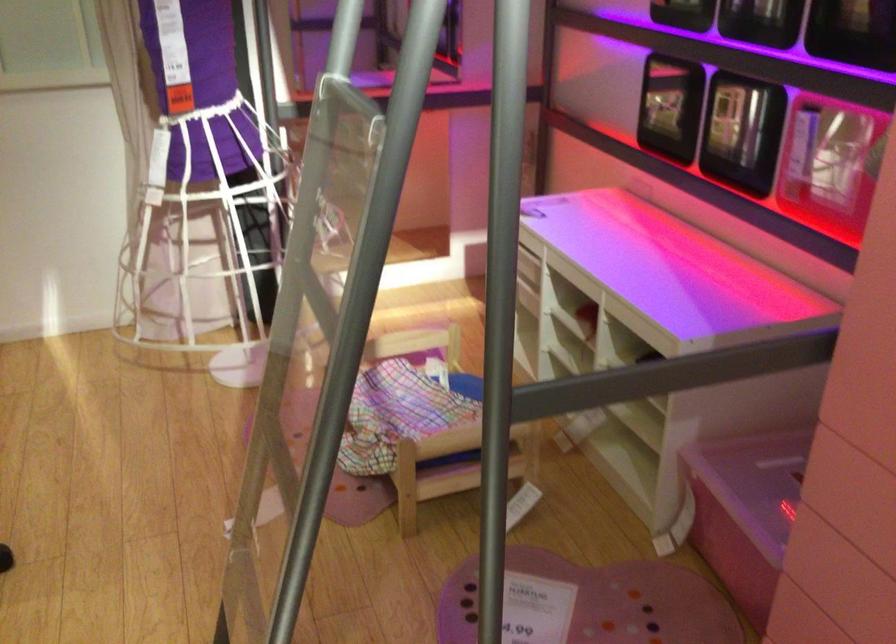
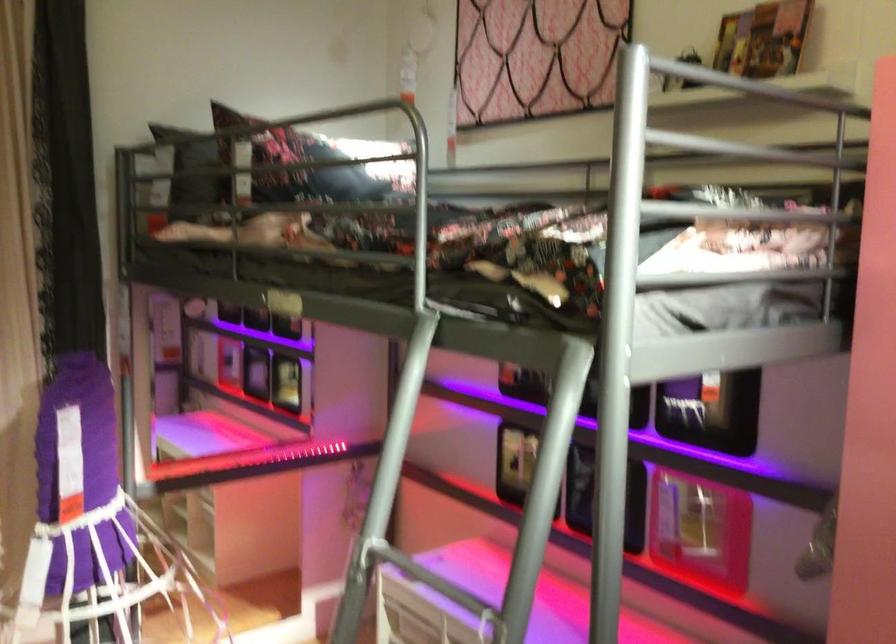
The first image is from the beginning of the video and the second image is from the end. How did the camera likely rotate when shooting the video?

The camera rotated toward right-up.